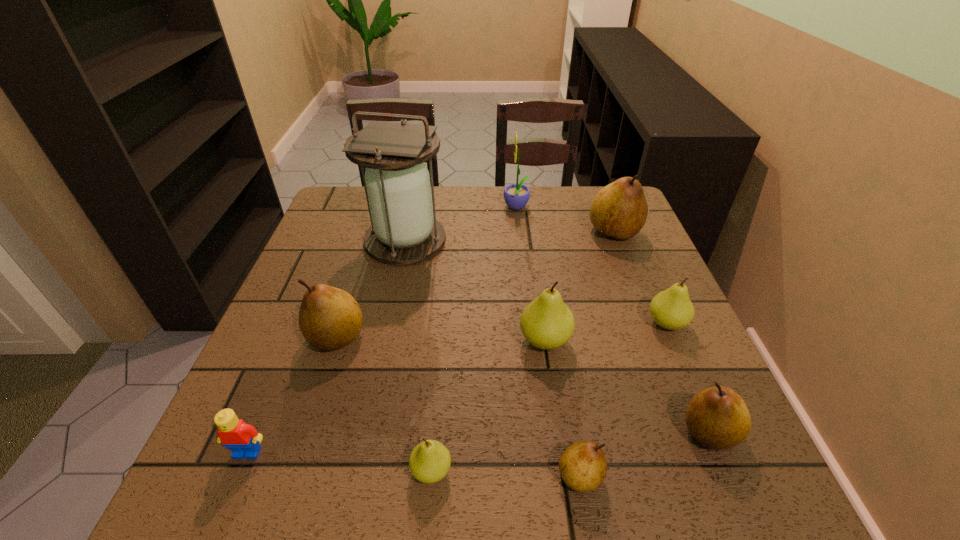
I want to click on vacant space located 0.270m on the front of the rightmost green pear, so click(x=727, y=462).

You are a GUI agent. You are given a task and a screenshot of the screen. Output one action in this format:
    pyautogui.click(x=<x>, y=<y>)
    Task: Click on the vacant space located 0.180m on the back of the third biggest brown pear
    Image resolution: width=960 pixels, height=540 pixels.
    Given the screenshot: What is the action you would take?
    point(668,334)

At what (x,y) coordinates should I click in order to perform the action: click on blank space located 0.120m on the back of the second pear from left to right. Please return your answer as a coordinate pair (x, y). Looking at the image, I should click on (438, 391).

Where is `free space located 0.340m on the left of the second brown pear from left to right`? This screenshot has width=960, height=540. free space located 0.340m on the left of the second brown pear from left to right is located at coordinates (348, 476).

Locate an element on the screen. This screenshot has height=540, width=960. lantern at the far edge is located at coordinates (397, 184).

You are a GUI agent. You are given a task and a screenshot of the screen. Output one action in this format:
    pyautogui.click(x=<x>, y=<y>)
    Task: Click on the sunflower at the far edge
    The width and height of the screenshot is (960, 540).
    Given the screenshot: What is the action you would take?
    pyautogui.click(x=516, y=196)

Identify the location of pear that is at the far edge. The width and height of the screenshot is (960, 540). (619, 210).

I want to click on Lego at the near edge, so click(243, 439).

In order to click on lantern that is at the left edge in this screenshot , I will do `click(397, 184)`.

Locate an element on the screen. The height and width of the screenshot is (540, 960). pear located at the left edge is located at coordinates (330, 318).